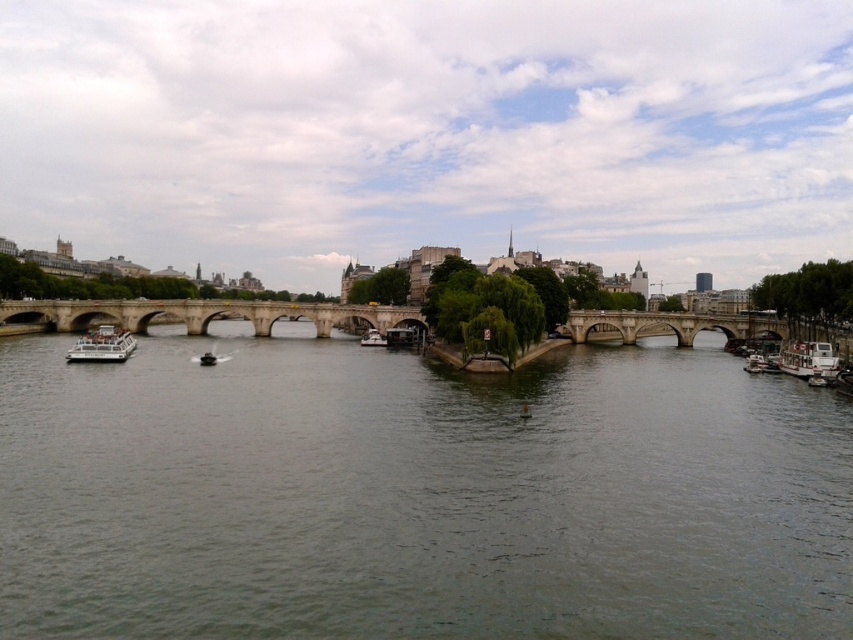
You are standing at the riverside and want to reach a specific point marked as point [387,321]. If your walking speed is 3 feet per second, how many seconds will it take to reach that point?

The distance of point [387,321] from viewer is 393.30 feet, so it will take 393.30 divided by 3 equals 131.1 seconds to reach the point.

In the scene shown: You are a tourist standing on the right bank of the river. You want to take a photo of the stone bridge at center and the white glossy boat at right. Which object should you point your camera upwards to capture?

You should point your camera upwards to capture the stone bridge at center because it is above the white glossy boat at right.

You are standing on the riverside and see two points marked in the image. Which point is closer to you, point (144, 516) or point (206, 356)?

Point (144, 516) is in front of point (206, 356), so it is closer to you.